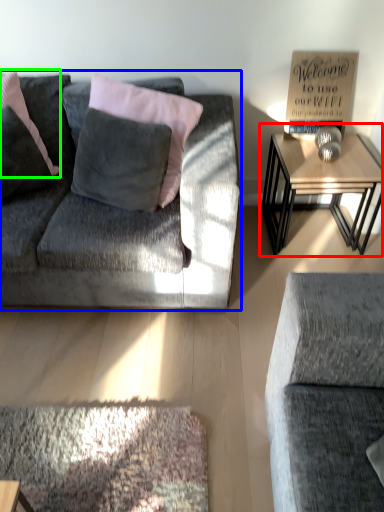
Question: Which object is positioned farthest from table (highlighted by a red box)? Select from studio couch (highlighted by a blue box) and pillow (highlighted by a green box).

Choices:
 (A) studio couch
 (B) pillow

Answer: (B)